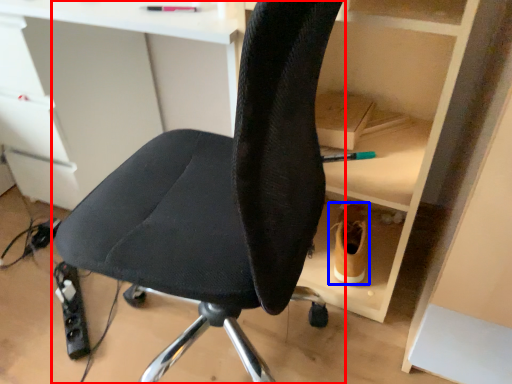
Question: Which object appears farthest to the camera in this image, chair (highlighted by a red box) or footwear (highlighted by a blue box)?

Choices:
 (A) chair
 (B) footwear

Answer: (B)